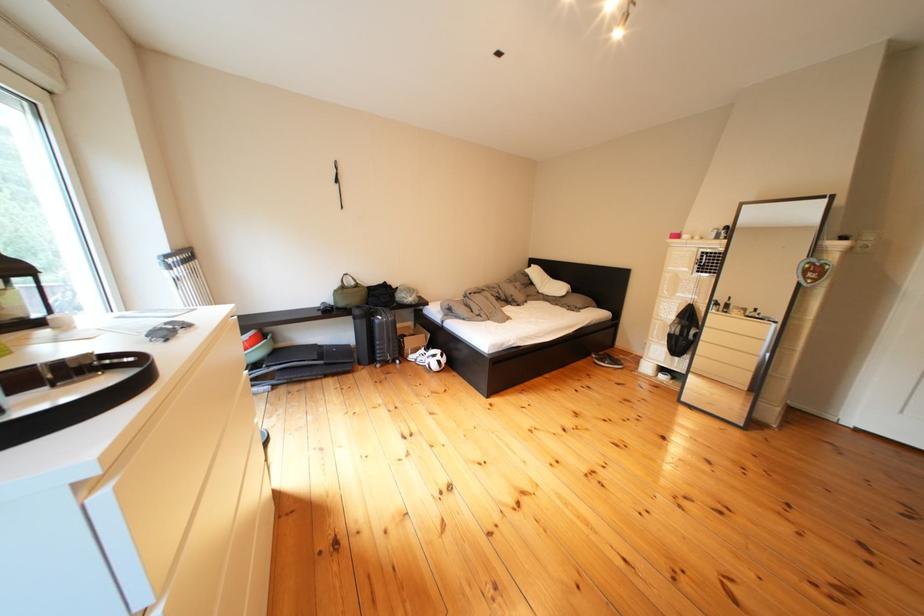
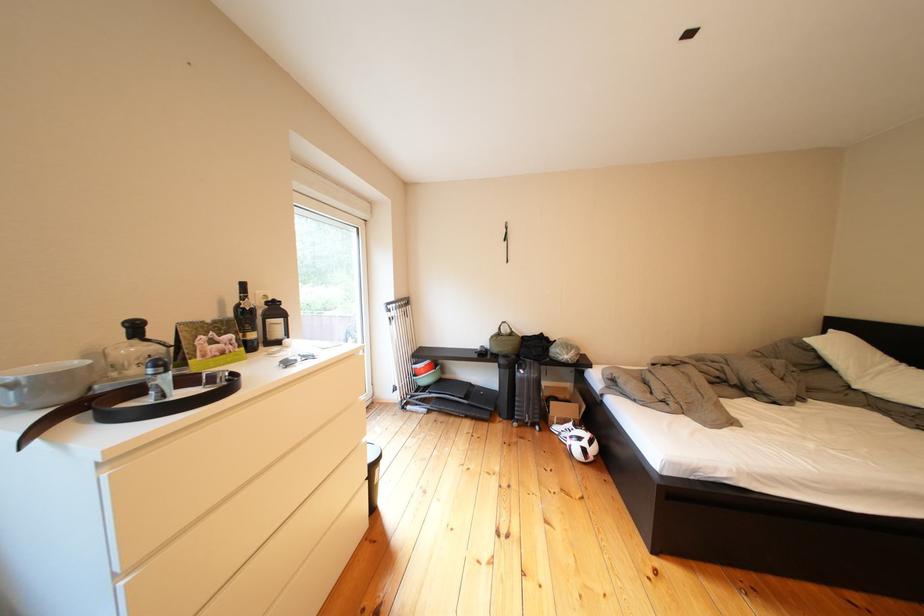
Question: How did the camera likely rotate?

Choices:
 (A) Left
 (B) Right
 (C) Up
 (D) Down

Answer: (A)